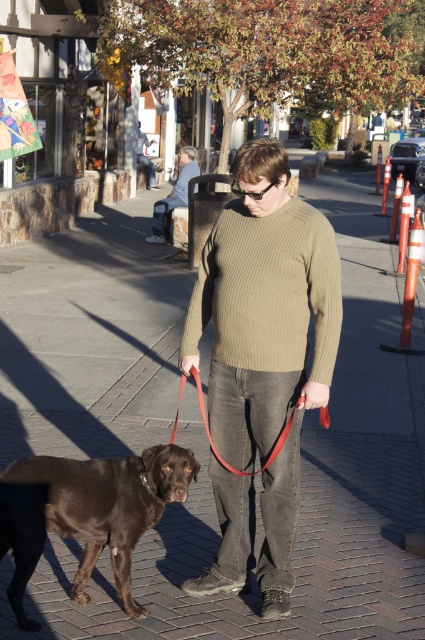
You are a fashion designer observing the knit sweater at center and the shiny brown dog at lower left in the image. Which object is taller?

The knit sweater at center is much taller than the shiny brown dog at lower left.

You are a fashion designer observing the man in the image. You need to determine which of the two sweaters he is wearing has a greater width. The sweaters in question are the olive ribbed sweater at center and the matte brown sweater at center. Which one is wider?

The olive ribbed sweater at center is wider than the matte brown sweater at center according to the description.